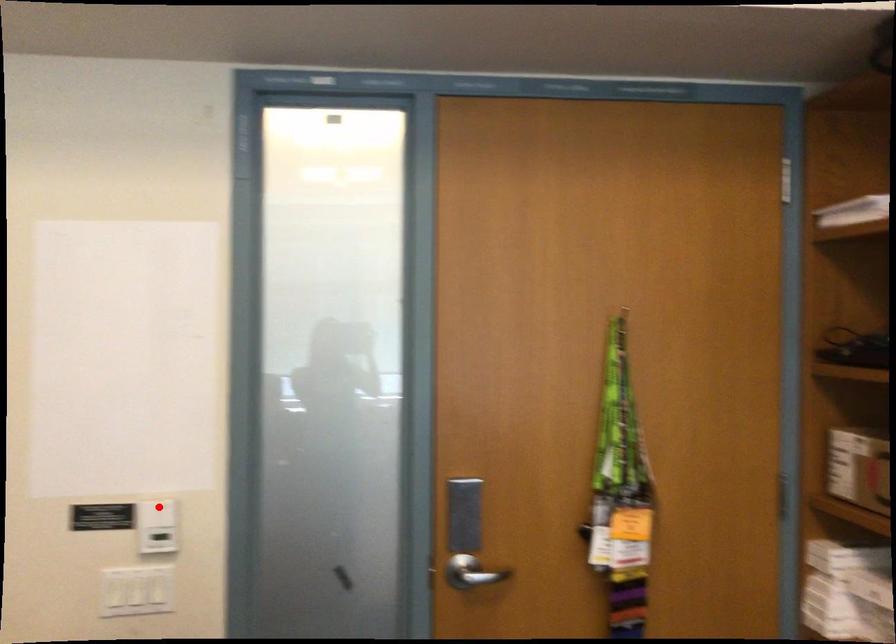
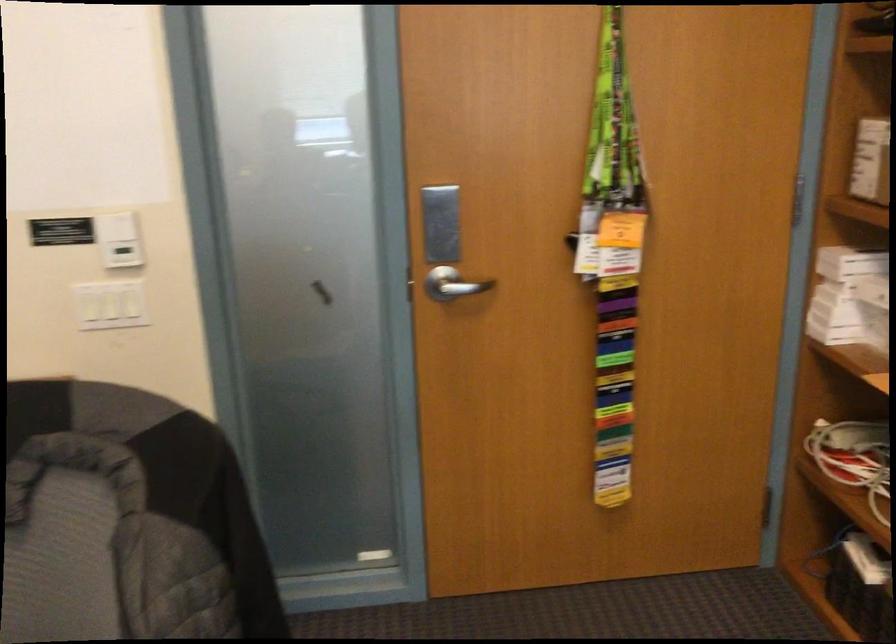
Locate, in the second image, the point that corresponds to the highlighted location in the first image.

(116, 225)